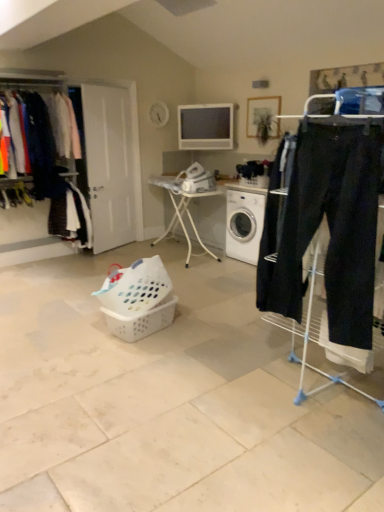
What do you see at coordinates (244, 223) in the screenshot? The width and height of the screenshot is (384, 512). I see `white plastic washing machine at center` at bounding box center [244, 223].

Identify the location of matte black clothes at left. (55, 168).

What is the approximate height of white plastic table at center?

white plastic table at center is 36.90 inches tall.

The image size is (384, 512). What do you see at coordinates (183, 212) in the screenshot? I see `white plastic table at center` at bounding box center [183, 212].

Image resolution: width=384 pixels, height=512 pixels. What do you see at coordinates (332, 225) in the screenshot? I see `dark blue cotton sweatpants at right` at bounding box center [332, 225].

What are the coordinates of `white plastic washing machine at center` in the screenshot? It's located at (244, 223).

What's the angular difference between dark blue cotton sweatpants at right and white plastic washing machine at center's facing directions?

8.97 degrees.

Is dark blue cotton sweatpants at right smaller than white plastic washing machine at center?

Yes, dark blue cotton sweatpants at right is smaller than white plastic washing machine at center.

Which object is further away from the camera taking this photo, dark blue cotton sweatpants at right or white plastic washing machine at center?

Positioned behind is white plastic washing machine at center.

From the image's perspective, is dark blue cotton sweatpants at right located beneath white plastic washing machine at center?

Correct, dark blue cotton sweatpants at right appears lower than white plastic washing machine at center in the image.

From a real-world perspective, who is located lower, dark blue fabric pants at left, the 2th clothing viewed from the top, or white plastic washing machine at center?

In real-world perspective, white plastic washing machine at center is lower.

In the scene shown: Could you tell me if dark blue fabric pants at left, the 2th clothing viewed from the top, is turned towards white plastic washing machine at center?

No, dark blue fabric pants at left, the 2th clothing viewed from the top, does not turn towards white plastic washing machine at center.

From the picture: Considering the relative sizes of dark blue fabric pants at left, marked as the first clothing in a bottom-to-top arrangement, and white plastic washing machine at center in the image provided, is dark blue fabric pants at left, marked as the first clothing in a bottom-to-top arrangement, shorter than white plastic washing machine at center?

In fact, dark blue fabric pants at left, marked as the first clothing in a bottom-to-top arrangement, may be taller than white plastic washing machine at center.

Considering the sizes of dark blue fabric pants at left, marked as the first clothing in a bottom-to-top arrangement, and matte black pants at left, the 2th clothing from the bottom, in the image, is dark blue fabric pants at left, marked as the first clothing in a bottom-to-top arrangement, taller or shorter than matte black pants at left, the 2th clothing from the bottom,?

In the image, dark blue fabric pants at left, marked as the first clothing in a bottom-to-top arrangement, appears to be shorter than matte black pants at left, the 2th clothing from the bottom.

Considering the relative positions of dark blue fabric pants at left, the 2th clothing viewed from the top, and matte black pants at left, which appears as the first clothing when viewed from the top, in the image provided, is dark blue fabric pants at left, the 2th clothing viewed from the top, to the right of matte black pants at left, which appears as the first clothing when viewed from the top, from the viewer's perspective?

Correct, you'll find dark blue fabric pants at left, the 2th clothing viewed from the top, to the right of matte black pants at left, which appears as the first clothing when viewed from the top.

Locate an element on the screen. This screenshot has width=384, height=512. clothing beneath the matte black pants at left, the 2th clothing from the bottom (from a real-world perspective) is located at coordinates (71, 217).

From a real-world perspective, is dark blue fabric pants at left, marked as the first clothing in a bottom-to-top arrangement, on matte black pants at left, the 2th clothing from the bottom?

No, from a real-world perspective, dark blue fabric pants at left, marked as the first clothing in a bottom-to-top arrangement, is not above matte black pants at left, the 2th clothing from the bottom.

Does matte black pants at left, which appears as the first clothing when viewed from the top, have a greater height compared to dark blue fabric pants at left, marked as the first clothing in a bottom-to-top arrangement?

Correct, matte black pants at left, which appears as the first clothing when viewed from the top, is much taller as dark blue fabric pants at left, marked as the first clothing in a bottom-to-top arrangement.

Is matte black pants at left, the 2th clothing from the bottom, in contact with dark blue fabric pants at left, the 2th clothing viewed from the top?

No, matte black pants at left, the 2th clothing from the bottom, is not next to dark blue fabric pants at left, the 2th clothing viewed from the top.

Is matte black pants at left, which appears as the first clothing when viewed from the top, oriented away from dark blue fabric pants at left, the 2th clothing viewed from the top?

No, dark blue fabric pants at left, the 2th clothing viewed from the top, is not at the back of matte black pants at left, which appears as the first clothing when viewed from the top.

Does matte black pants at left, the 2th clothing from the bottom, have a larger size compared to dark blue fabric pants at left, the 2th clothing viewed from the top?

Correct, matte black pants at left, the 2th clothing from the bottom, is larger in size than dark blue fabric pants at left, the 2th clothing viewed from the top.

In terms of width, does dark blue fabric pants at left, the 2th clothing viewed from the top, look wider or thinner when compared to dark blue cotton sweatpants at right?

Considering their sizes, dark blue fabric pants at left, the 2th clothing viewed from the top, looks broader than dark blue cotton sweatpants at right.

Is dark blue fabric pants at left, the 2th clothing viewed from the top, oriented towards dark blue cotton sweatpants at right?

Yes, dark blue fabric pants at left, the 2th clothing viewed from the top, is aimed at dark blue cotton sweatpants at right.

Does dark blue fabric pants at left, the 2th clothing viewed from the top, have a greater height compared to dark blue cotton sweatpants at right?

Incorrect, the height of dark blue fabric pants at left, the 2th clothing viewed from the top, is not larger of that of dark blue cotton sweatpants at right.

From the image's perspective, count 1st clothings upward from the dark blue cotton sweatpants at right and point to it. Please provide its 2D coordinates.

[(71, 217)]

Considering the sizes of objects white plastic washing machine at center and dark blue fabric pants at left, marked as the first clothing in a bottom-to-top arrangement, in the image provided, who is shorter, white plastic washing machine at center or dark blue fabric pants at left, marked as the first clothing in a bottom-to-top arrangement,?

With less height is white plastic washing machine at center.

From a real-world perspective, is white plastic washing machine at center on top of dark blue fabric pants at left, the 2th clothing viewed from the top?

No, from a real-world perspective, white plastic washing machine at center is not over dark blue fabric pants at left, the 2th clothing viewed from the top

Is white plastic washing machine at center behind dark blue fabric pants at left, marked as the first clothing in a bottom-to-top arrangement?

No, white plastic washing machine at center is closer to the camera.

How many degrees apart are the facing directions of white plastic washing machine at center and dark blue fabric pants at left, the 2th clothing viewed from the top?

86.2 degrees.

Which of these two, matte black pants at left, which appears as the first clothing when viewed from the top, or white plastic table at center, is smaller?

matte black pants at left, which appears as the first clothing when viewed from the top.

Consider the image. From the image's perspective, relative to white plastic table at center, is matte black pants at left, which appears as the first clothing when viewed from the top, above or below?

Based on their image positions, matte black pants at left, which appears as the first clothing when viewed from the top, is located above white plastic table at center.

Is matte black pants at left, the 2th clothing from the bottom, facing towards white plastic table at center?

No, matte black pants at left, the 2th clothing from the bottom, is not oriented towards white plastic table at center.

I want to click on washing machine that is behind the dark blue cotton sweatpants at right, so click(x=244, y=223).

Identify the location of the 1st clothing to the left when counting from the white plastic washing machine at center. The image size is (384, 512). (71, 217).

From the image, which object appears to be farther from white plastic table at center, white plastic basket at center, acting as the first basket starting from the bottom, or white plastic washing machine at center?

white plastic basket at center, acting as the first basket starting from the bottom, is positioned further to the anchor white plastic table at center.

Estimate the real-world distances between objects in this image. Which object is closer to white plastic table at center, matte black pants at left, the 2th clothing from the bottom, or white plastic laundry basket at center, positioned as the first basket in top-to-bottom order?

Based on the image, matte black pants at left, the 2th clothing from the bottom, appears to be nearer to white plastic table at center.

When comparing their distances from dark blue fabric pants at left, marked as the first clothing in a bottom-to-top arrangement, does matte black clothes at left or dark blue cotton sweatpants at right seem further?

dark blue cotton sweatpants at right is positioned further to the anchor dark blue fabric pants at left, marked as the first clothing in a bottom-to-top arrangement.

Considering their positions, is white plastic basket at center, which is the 2th basket from top to bottom, positioned closer to matte black pants at left, which appears as the first clothing when viewed from the top, than dark blue fabric pants at left, marked as the first clothing in a bottom-to-top arrangement?

dark blue fabric pants at left, marked as the first clothing in a bottom-to-top arrangement, lies closer to matte black pants at left, which appears as the first clothing when viewed from the top, than the other object.

Based on their spatial positions, is matte black clothes at left or matte black pants at left, the 2th clothing from the bottom, closer to white plastic laundry basket at center, positioned as the 2th basket in bottom-to-top order?

The object closer to white plastic laundry basket at center, positioned as the 2th basket in bottom-to-top order, is matte black clothes at left.

When comparing their distances from white plastic laundry basket at center, positioned as the first basket in top-to-bottom order, does white plastic washing machine at center or dark blue fabric pants at left, marked as the first clothing in a bottom-to-top arrangement, seem closer?

The object closer to white plastic laundry basket at center, positioned as the first basket in top-to-bottom order, is white plastic washing machine at center.

Looking at the image, which one is located further to white plastic basket at center, acting as the first basket starting from the bottom, dark blue cotton sweatpants at right or matte black pants at left, which appears as the first clothing when viewed from the top?

Based on the image, matte black pants at left, which appears as the first clothing when viewed from the top, appears to be further to white plastic basket at center, acting as the first basket starting from the bottom.

Estimate the real-world distances between objects in this image. Which object is closer to matte black clothes at left, white plastic table at center or white plastic basket at center, which is the 2th basket from top to bottom?

white plastic table at center is positioned closer to the anchor matte black clothes at left.

Where is `table between dark blue fabric pants at left, marked as the first clothing in a bottom-to-top arrangement, and white plastic washing machine at center from left to right`? table between dark blue fabric pants at left, marked as the first clothing in a bottom-to-top arrangement, and white plastic washing machine at center from left to right is located at coordinates (183, 212).

Where is `table positioned between white plastic basket at center, acting as the first basket starting from the bottom, and dark blue fabric pants at left, marked as the first clothing in a bottom-to-top arrangement, from near to far`? The height and width of the screenshot is (512, 384). table positioned between white plastic basket at center, acting as the first basket starting from the bottom, and dark blue fabric pants at left, marked as the first clothing in a bottom-to-top arrangement, from near to far is located at coordinates (183, 212).

This screenshot has width=384, height=512. Identify the location of table between white plastic laundry basket at center, positioned as the first basket in top-to-bottom order, and white plastic washing machine at center from front to back. (183, 212).

Locate an element on the screen. This screenshot has width=384, height=512. basket located between white plastic laundry basket at center, positioned as the 2th basket in bottom-to-top order, and white plastic washing machine at center in the depth direction is located at coordinates (141, 321).